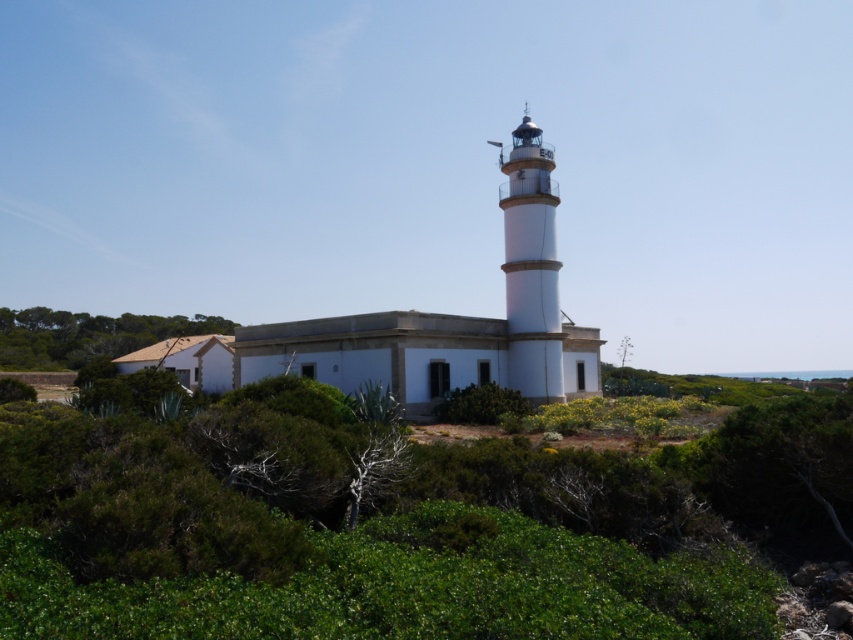
What are the coordinates of `green leafy shrubs at center` in the screenshot? It's located at (386, 525).

Who is lower down, green leafy shrubs at center or white smooth tower at center?

green leafy shrubs at center

Who is more distant from viewer, (238, 608) or (506, 193)?

The point (506, 193) is behind.

Identify the location of green leafy shrubs at center. (386, 525).

Who is lower down, green leafy shrubs at center or green leafy shrubs at lower left?

green leafy shrubs at center is below.

Is green leafy shrubs at center taller than green leafy shrubs at lower left?

No, green leafy shrubs at center is not taller than green leafy shrubs at lower left.

The width and height of the screenshot is (853, 640). I want to click on green leafy shrubs at center, so click(386, 525).

The height and width of the screenshot is (640, 853). I want to click on green leafy shrubs at center, so [x=386, y=525].

Can you confirm if white smooth tower at center is positioned to the left of green leafy shrubs at lower left?

No, white smooth tower at center is not to the left of green leafy shrubs at lower left.

Between point (556, 198) and point (45, 369), which one is positioned in front?

Point (556, 198) is more forward.

In order to click on white smooth tower at center in this screenshot , I will do `click(531, 268)`.